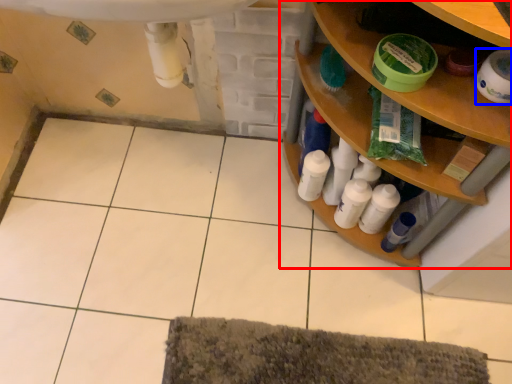
Question: Which point is further to the camera, shelf (highlighted by a red box) or toilet paper (highlighted by a blue box)?

Choices:
 (A) shelf
 (B) toilet paper

Answer: (B)